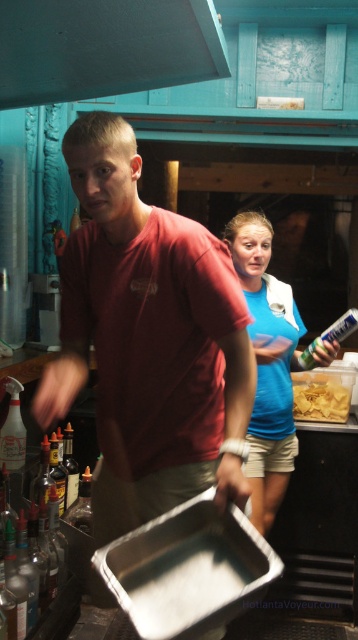
You are in a kitchen and see the point marked at coordinates [267,364]. What object is located at that point?

The point at [267,364] indicates the blue cotton shirt at center.

You are standing in the kitchen and see the smooth matte black exhaust hood at upper center and the clear glass bottle at left. Which object is positioned to the right of the other?

The smooth matte black exhaust hood at upper center is to the right of the clear glass bottle at left.

From the picture: You are organizing a kitchen pantry and need to place both the blue cotton shirt at center and the translucent plastic bottle at left on a shelf. Given their sizes, which item should you place first to ensure both fit properly?

The blue cotton shirt at center is larger in size than the translucent plastic bottle at left, so you should place the blue cotton shirt at center first to ensure both items fit on the shelf.